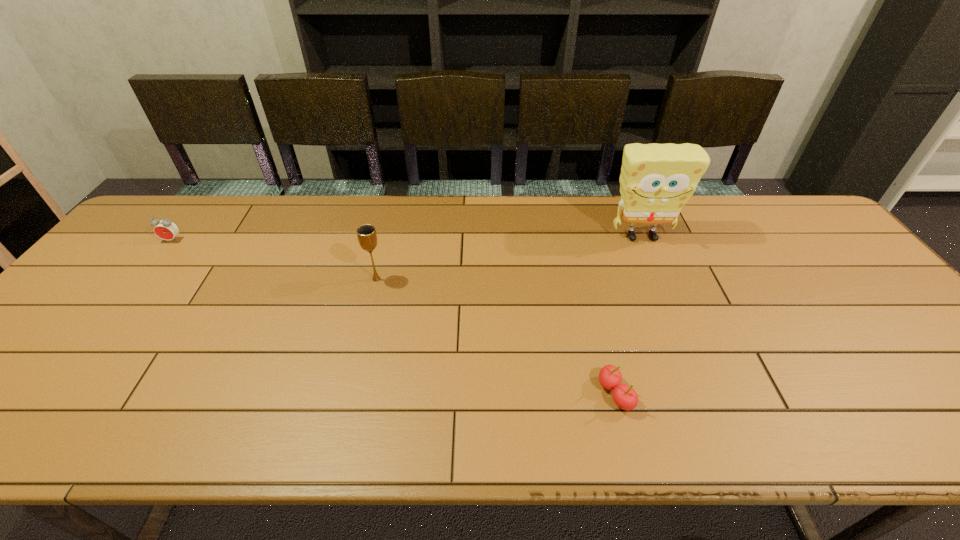
Identify the location of vacant space situated 0.240m on the right of the nearest object. The height and width of the screenshot is (540, 960). (742, 394).

Where is `sponge that is at the far edge`? This screenshot has height=540, width=960. sponge that is at the far edge is located at coordinates (656, 181).

Where is `alarm clock that is at the far edge`? alarm clock that is at the far edge is located at coordinates (165, 229).

Where is `object that is positioned at the near edge`? Image resolution: width=960 pixels, height=540 pixels. object that is positioned at the near edge is located at coordinates (625, 397).

You are a GUI agent. You are given a task and a screenshot of the screen. Output one action in this format:
    pyautogui.click(x=<x>, y=<y>)
    Task: Click on the object at the left edge
    This screenshot has height=540, width=960.
    Given the screenshot: What is the action you would take?
    pyautogui.click(x=165, y=229)

What are the coordinates of `object situated at the far left corner` in the screenshot? It's located at (165, 229).

You are a GUI agent. You are given a task and a screenshot of the screen. Output one action in this format:
    pyautogui.click(x=<x>, y=<y>)
    Task: Click on the vacant space at the far edge of the desktop
    The image size is (960, 540).
    Given the screenshot: What is the action you would take?
    pyautogui.click(x=310, y=228)

At what (x,y) coordinates should I click in order to perform the action: click on free point at the near edge. Please return your answer as a coordinate pair (x, y). Looking at the image, I should click on (298, 429).

Image resolution: width=960 pixels, height=540 pixels. In the image, there is a desktop. What are the coordinates of `free space at the left edge` in the screenshot? It's located at (97, 302).

In the image, there is a desktop. Where is `vacant space at the right edge`? The height and width of the screenshot is (540, 960). vacant space at the right edge is located at coordinates (803, 268).